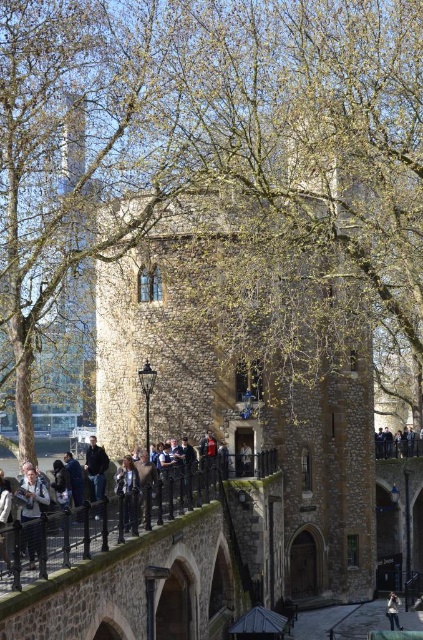
Question: Which object appears closest to the camera in this image?

Choices:
 (A) light brown leather jacket at center
 (B) matte black people at center

Answer: (B)

Question: Which object is farther from the camera taking this photo?

Choices:
 (A) light brown leather jacket at center
 (B) matte black people at center

Answer: (A)

Question: Is dark blue jeans at lower right behind light brown leather jacket at center?

Choices:
 (A) no
 (B) yes

Answer: (B)

Question: Where is matte black people at center located in relation to dark blue jeans at lower right in the image?

Choices:
 (A) above
 (B) below

Answer: (A)

Question: Where is matte black people at center located in relation to denim jacket at lower left in the image?

Choices:
 (A) above
 (B) below

Answer: (B)

Question: Which of these objects is positioned closest to the matte black people at center?

Choices:
 (A) light brown leather jacket at center
 (B) denim jacket at lower left

Answer: (B)